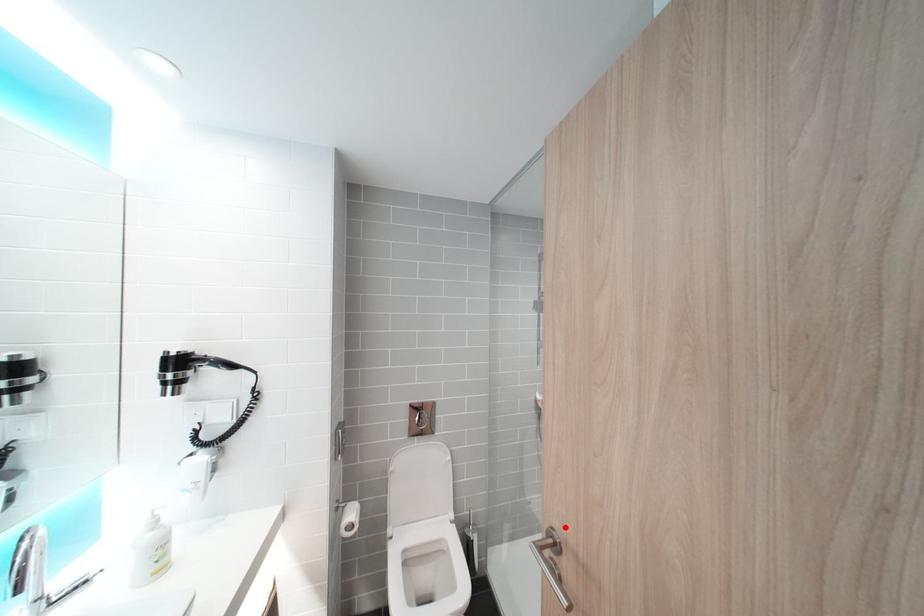
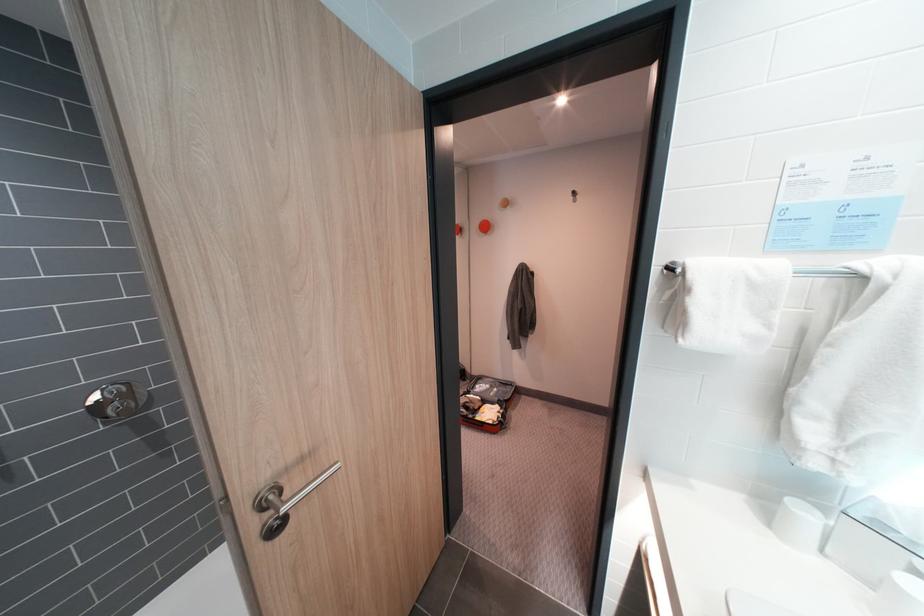
Question: I am providing you with two images of the same scene from different viewpoints. Image1 has a red point marked. In image2, the corresponding 3D location appears at what relative position? Reply with the corresponding letter.

Choices:
 (A) Closer
 (B) Farther

Answer: (B)